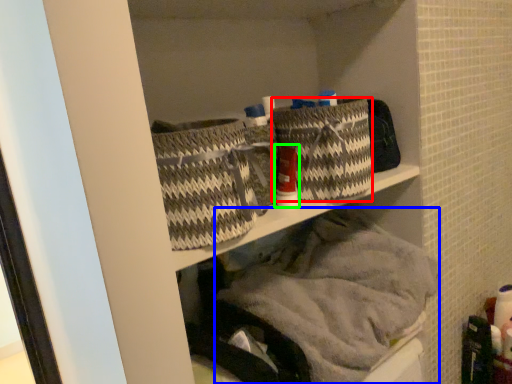
Question: Which object is positioned closest to basket (highlighted by a red box)? Select from material (highlighted by a blue box) and toiletry (highlighted by a green box).

Choices:
 (A) material
 (B) toiletry

Answer: (B)